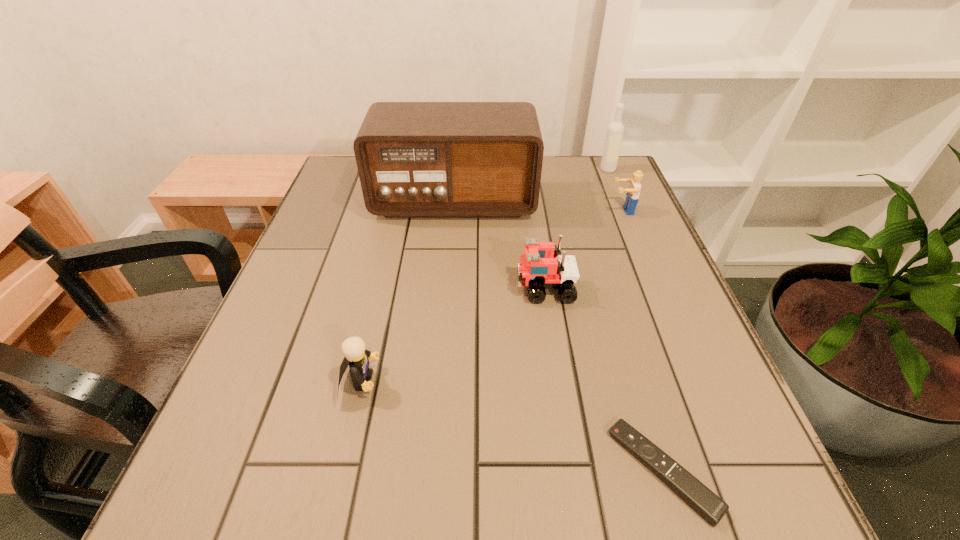
Identify the location of free space that satisfies the following two spatial constraints: 1. on the front-facing side of the shortest object; 2. on the right side of the second farthest Lego. (573, 470).

Locate an element on the screen. Image resolution: width=960 pixels, height=540 pixels. free space in the image that satisfies the following two spatial constraints: 1. on the front-facing side of the tallest object; 2. on the right side of the shortest object is located at coordinates (433, 470).

At what (x,y) coordinates should I click in order to perform the action: click on blank area in the image that satisfies the following two spatial constraints: 1. on the front-facing side of the tallest object; 2. on the front-facing side of the leftmost Lego. Please return your answer as a coordinate pair (x, y). Looking at the image, I should click on (440, 381).

The width and height of the screenshot is (960, 540). I want to click on vacant area in the image that satisfies the following two spatial constraints: 1. on the back side of the shortest object; 2. on the front-facing side of the second nearest object, so click(636, 381).